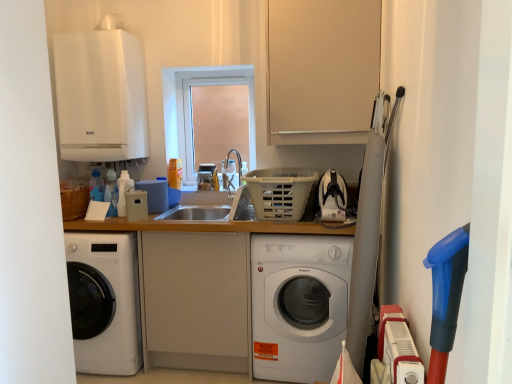
Question: From a real-world perspective, is beige plastic speaker at center, the first appliance from the front, physically located above or below white matte boiler at upper left, marked as the 1th appliance in a top-to-bottom arrangement?

Choices:
 (A) below
 (B) above

Answer: (A)

Question: From the image's perspective, is beige plastic speaker at center, arranged as the second appliance when viewed from the right, positioned above or below white matte boiler at upper left, marked as the 1th appliance in a top-to-bottom arrangement?

Choices:
 (A) below
 (B) above

Answer: (A)

Question: Estimate the real-world distances between objects in this image. Which object is farther from the white matte washing machine at center?

Choices:
 (A) white matte boiler at upper left, which is the third appliance from right to left
 (B) transparent glass window at center
 (C) wooden counter at center
 (D) matte silver faucet at center
 (E) metallic silver sink at center, which is counted as the 2th appliance, starting from the top

Answer: (A)

Question: Based on their relative distances, which object is nearer to the white plastic basket at center?

Choices:
 (A) beige matte cabinet at upper center
 (B) transparent glass window at center
 (C) matte silver faucet at center
 (D) metallic silver sink at center, the first appliance viewed from the right
 (E) wooden counter at center

Answer: (E)